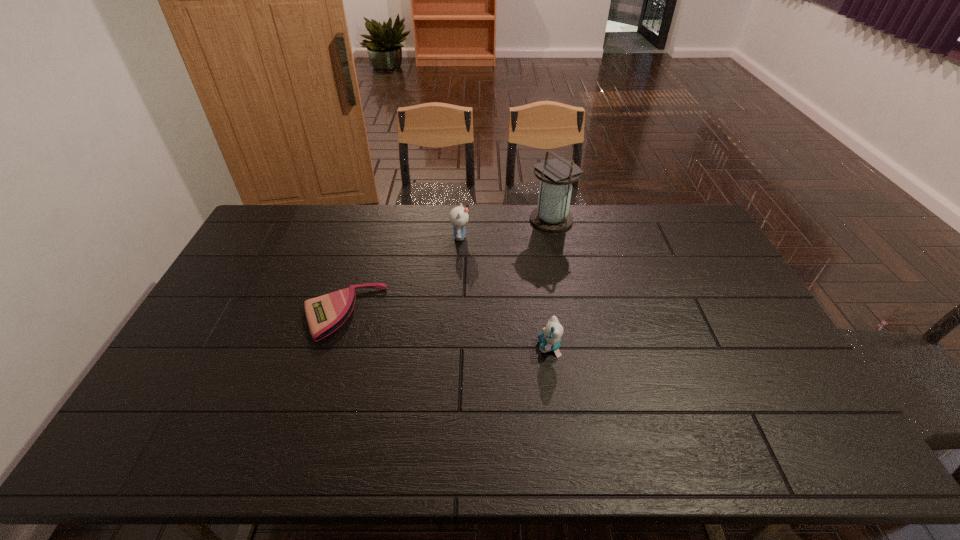
This screenshot has width=960, height=540. Identify the location of empty space between the wristlet and the third object from right to left. (401, 275).

Image resolution: width=960 pixels, height=540 pixels. What are the coordinates of `vacant space that's between the shortest object and the nearer kitten` in the screenshot? It's located at (445, 330).

Select which object is the second closest to the left kitten. Please provide its 2D coordinates. Your answer should be formatted as a tuple, i.e. [(x, y)], where the tuple contains the x and y coordinates of a point satisfying the conditions above.

[(325, 314)]

Identify the location of the third closest object to the shorter kitten. (552, 214).

Locate an element on the screen. vacant space that satisfies the following two spatial constraints: 1. on the front-facing side of the left kitten; 2. on the front side of the wristlet is located at coordinates (456, 314).

This screenshot has height=540, width=960. I want to click on vacant point that satisfies the following two spatial constraints: 1. on the back side of the lantern; 2. on the left side of the shortest object, so click(372, 220).

Identify the location of free location that satisfies the following two spatial constraints: 1. on the front side of the lantern; 2. on the front-facing side of the taller kitten. This screenshot has width=960, height=540. (555, 237).

In order to click on vacant position in the image that satisfies the following two spatial constraints: 1. on the back side of the tallest object; 2. on the left side of the leftmost object in this screenshot , I will do `click(372, 220)`.